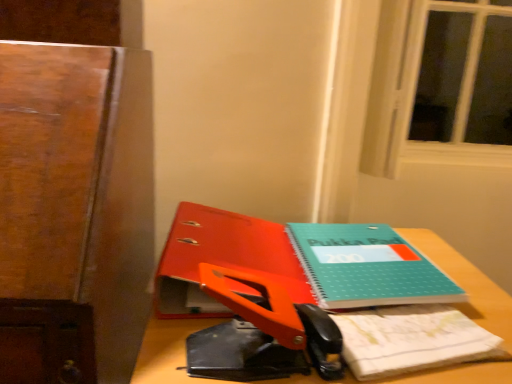
The image size is (512, 384). What do you see at coordinates (411, 339) in the screenshot?
I see `teal matte notepad at center` at bounding box center [411, 339].

Image resolution: width=512 pixels, height=384 pixels. Describe the element at coordinates (367, 267) in the screenshot. I see `teal matte notebook at center` at that location.

What is the approximate width of teal matte notebook at center?

teal matte notebook at center is 12.72 inches in width.

What is the approximate width of teal matte notebook at center?

teal matte notebook at center is 13.77 inches in width.

Image resolution: width=512 pixels, height=384 pixels. I want to click on teal matte notebook at center, so click(221, 258).

Find the location of `teal matte notepad at center`. teal matte notepad at center is located at coordinates (411, 339).

From a real-world perspective, which object rests below the other?

From a 3D spatial view, wooden desk at center is below.

From the image's perspective, between wooden desk at center and teal matte notebook at center, which one is located above?

teal matte notebook at center is shown above in the image.

This screenshot has height=384, width=512. In order to click on desk that is in front of the teal matte notebook at center in this screenshot , I will do `click(468, 284)`.

Is wooden desk at center oriented towards teal matte notebook at center?

No, wooden desk at center is not turned towards teal matte notebook at center.

Considering the relative sizes of wooden desk at center and teal matte notebook at center in the image provided, is wooden desk at center shorter than teal matte notebook at center?

In fact, wooden desk at center may be taller than teal matte notebook at center.

Based on the photo, is wooden desk at center not near teal matte notebook at center?

wooden desk at center is actually quite close to teal matte notebook at center.

Based on their sizes in the image, would you say wooden desk at center is bigger or smaller than teal matte notebook at center?

In the image, wooden desk at center appears to be larger than teal matte notebook at center.

In the scene shown: Is teal matte notepad at center looking in the opposite direction of teal matte notebook at center?

No, teal matte notepad at center's orientation is not away from teal matte notebook at center.

From a real-world perspective, relative to teal matte notebook at center, is teal matte notepad at center vertically above or below?

teal matte notepad at center is below teal matte notebook at center.

Is teal matte notepad at center inside the boundaries of teal matte notebook at center, or outside?

teal matte notepad at center is located beyond the bounds of teal matte notebook at center.

Considering the positions of objects teal matte notepad at center and teal matte notebook at center in the image provided, who is behind, teal matte notepad at center or teal matte notebook at center?

teal matte notebook at center is more distant.

This screenshot has height=384, width=512. I want to click on paperback book that is above the wooden desk at center (from a real-world perspective), so pyautogui.click(x=221, y=258).

How far apart are teal matte notebook at center and wooden desk at center?

teal matte notebook at center is 18.71 centimeters away from wooden desk at center.

Is point (196, 297) positioned behind point (446, 247)?

That is False.

Does teal matte notebook at center have a lesser height compared to wooden desk at center?

Correct, teal matte notebook at center is not as tall as wooden desk at center.

Which of these two, orange plastic scissors at center or teal matte notepad at center, stands shorter?

With less height is teal matte notepad at center.

From the image's perspective, is orange plastic scissors at center positioned above or below teal matte notepad at center?

Based on their image positions, orange plastic scissors at center is located above teal matte notepad at center.

Which of these two, orange plastic scissors at center or teal matte notepad at center, is smaller?

teal matte notepad at center.

Can you confirm if orange plastic scissors at center is wider than teal matte notepad at center?

Indeed, orange plastic scissors at center has a greater width compared to teal matte notepad at center.

Is teal matte notepad at center spatially inside orange plastic scissors at center, or outside of it?

teal matte notepad at center is not enclosed by orange plastic scissors at center.

Is teal matte notepad at center not close to orange plastic scissors at center?

No, teal matte notepad at center is not far away from orange plastic scissors at center.

Considering the relative sizes of teal matte notepad at center and orange plastic scissors at center in the image provided, is teal matte notepad at center bigger than orange plastic scissors at center?

No.

Does point (421, 361) lie behind point (282, 374)?

Yes, point (421, 361) is farther from viewer.

From a real-world perspective, relative to teal matte notebook at center, is orange plastic scissors at center vertically above or below?

In terms of real-world spatial position, orange plastic scissors at center is above teal matte notebook at center.

Can you confirm if orange plastic scissors at center is shorter than teal matte notebook at center?

In fact, orange plastic scissors at center may be taller than teal matte notebook at center.

Is orange plastic scissors at center turned away from teal matte notebook at center?

Yes, teal matte notebook at center is at the back of orange plastic scissors at center.

Find the location of a particular element. This screenshot has width=512, height=384. desk that appears below the teal matte notebook at center (from a real-world perspective) is located at coordinates (468, 284).

You are a GUI agent. You are given a task and a screenshot of the screen. Output one action in this format:
    pyautogui.click(x=<x>, y=<y>)
    Task: Click on the paperback book above the wooden desk at center (from a real-world perspective)
    This screenshot has width=512, height=384.
    Given the screenshot: What is the action you would take?
    pyautogui.click(x=221, y=258)

From the image, which object appears to be nearer to teal matte notepad at center, teal matte notebook at center or teal matte notebook at center?

Among the two, teal matte notebook at center is located nearer to teal matte notepad at center.

From the image, which object appears to be farther from orange plastic scissors at center, teal matte notebook at center or teal matte notepad at center?

teal matte notepad at center lies further to orange plastic scissors at center than the other object.

Based on their spatial positions, is wooden desk at center or teal matte notebook at center closer to orange plastic scissors at center?

The object closer to orange plastic scissors at center is wooden desk at center.

Considering their positions, is teal matte notebook at center positioned closer to wooden desk at center than teal matte notebook at center?

The object closer to wooden desk at center is teal matte notebook at center.

When comparing their distances from wooden desk at center, does teal matte notepad at center or teal matte notebook at center seem closer?

Based on the image, teal matte notepad at center appears to be nearer to wooden desk at center.

Looking at the image, which one is located closer to wooden desk at center, orange plastic scissors at center or teal matte notebook at center?

orange plastic scissors at center is positioned closer to the anchor wooden desk at center.

When comparing their distances from wooden desk at center, does teal matte notebook at center or teal matte notebook at center seem further?

Among the two, teal matte notebook at center is located further to wooden desk at center.

Estimate the real-world distances between objects in this image. Which object is closer to wooden desk at center, teal matte notebook at center or teal matte notepad at center?

The object closer to wooden desk at center is teal matte notepad at center.

In order to click on book that lies between teal matte notebook at center and wooden desk at center from top to bottom in this screenshot , I will do `click(367, 267)`.

This screenshot has height=384, width=512. Find the location of `book between teal matte notebook at center and teal matte notepad at center from left to right`. book between teal matte notebook at center and teal matte notepad at center from left to right is located at coordinates (367, 267).

At what (x,y) coordinates should I click in order to perform the action: click on notepad between teal matte notebook at center and wooden desk at center in the vertical direction. Please return your answer as a coordinate pair (x, y). The image size is (512, 384). Looking at the image, I should click on (411, 339).

Locate an element on the screen. notepad between teal matte notebook at center and wooden desk at center in the vertical direction is located at coordinates (411, 339).